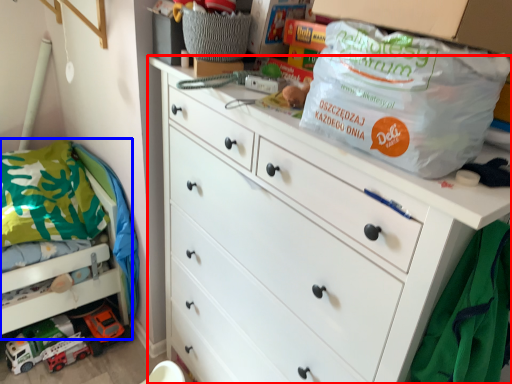
Question: Which of the following is the closest to the observer, chest of drawers (highlighted by a red box) or bunk bed (highlighted by a blue box)?

Choices:
 (A) chest of drawers
 (B) bunk bed

Answer: (A)